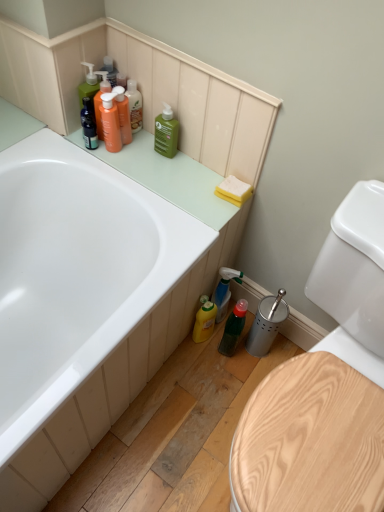
Locate an element on the screen. free space to the left of green matte bottle at upper center, which ranks as the third cleaning product in right-to-left order is located at coordinates (127, 152).